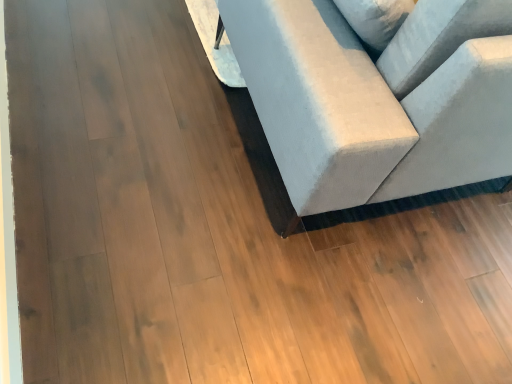
Locate an element on the screen. vacant area that is in front of suede-like gray couch at lower right is located at coordinates (262, 265).